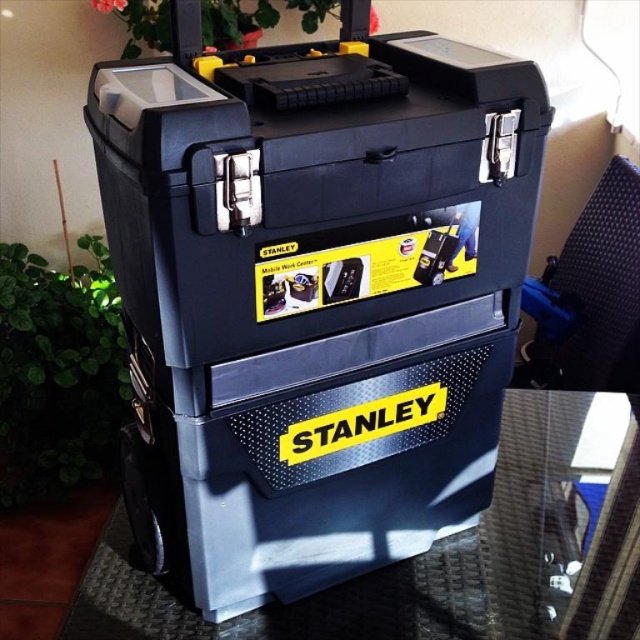
Question: Which point is farther to the camera?

Choices:
 (A) (515, 573)
 (B) (296, 557)

Answer: (A)

Question: Which of the following is the closest to the observer?

Choices:
 (A) (227, 156)
 (B) (531, 532)

Answer: (A)

Question: Which of the following is the farthest from the observer?

Choices:
 (A) matte black toolbox at center
 (B) transparent glass table at lower right

Answer: (B)

Question: From the image, what is the correct spatial relationship of matte black toolbox at center in relation to transparent glass table at lower right?

Choices:
 (A) above
 (B) below

Answer: (A)

Question: From the image, what is the correct spatial relationship of matte black toolbox at center in relation to transparent glass table at lower right?

Choices:
 (A) below
 (B) above

Answer: (B)

Question: Is matte black toolbox at center behind transparent glass table at lower right?

Choices:
 (A) no
 (B) yes

Answer: (A)